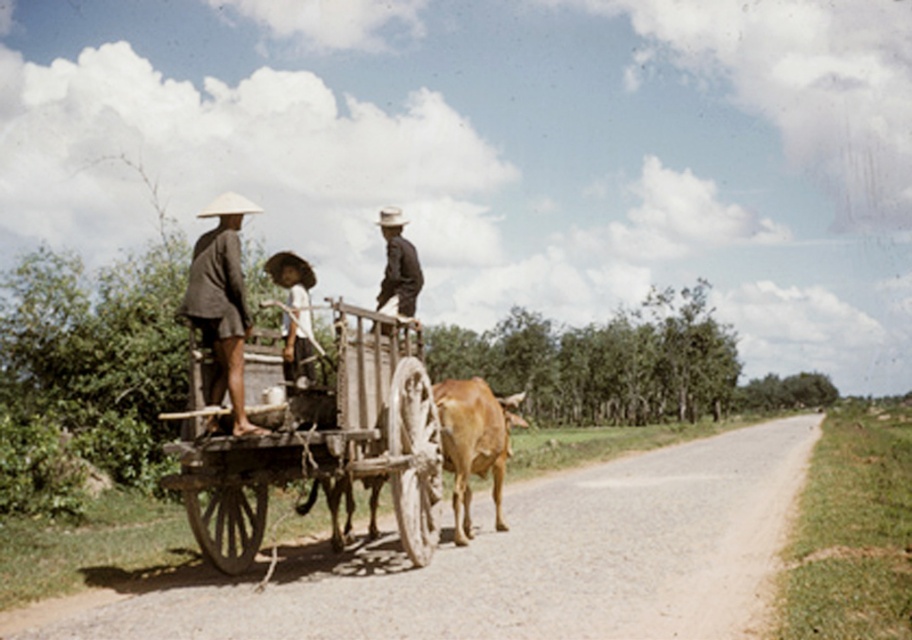
Based on the scene description, can you determine if the wooden wagon at center is wider than the dark brown fabric hat at center?

The wooden wagon at center is wider than the dark brown fabric hat at center according to the objects description.

You are standing at the starting point and want to reach the destination point. The path is along the dirt road where the wooden cart is moving. There are two points marked on the path. The first point is at coordinates point (240,417) and the second point is at coordinates point (416,260). If you start walking from the first point towards the destination, will you pass through the second point?

Yes, because point (240,417) is in front of point (416,260), so walking from the first point towards the destination would require passing through the second point.

You are a traveler who needs to decide whether to place your backpack on the wooden wagon at center or the dark brown fabric hat at center. Which object can accommodate your backpack based on their sizes?

The wooden wagon at center is larger in size than the dark brown fabric hat at center, so the wooden wagon at center can accommodate your backpack.